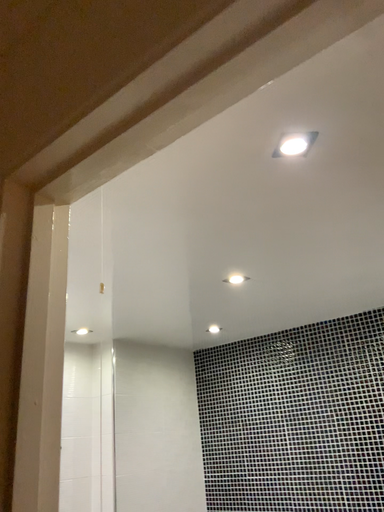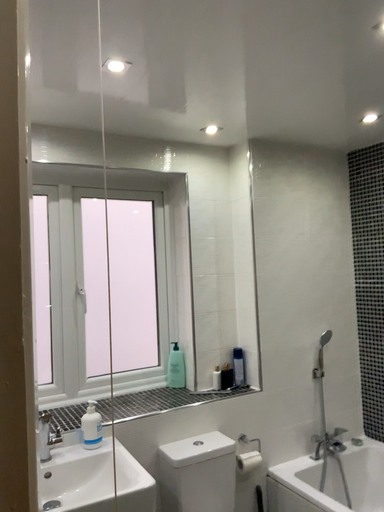
Question: How did the camera likely rotate when shooting the video?

Choices:
 (A) rotated left
 (B) rotated right

Answer: (A)